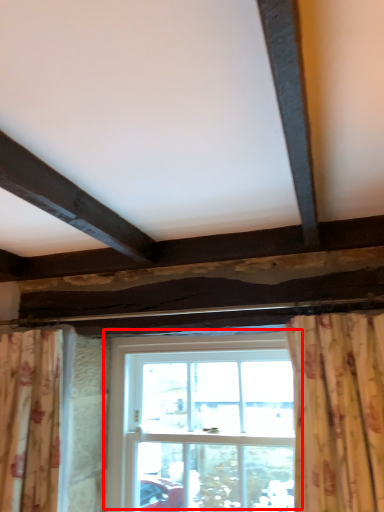
Question: From the image's perspective, where is window (annotated by the red box) located in relation to curtain in the image?

Choices:
 (A) above
 (B) below

Answer: (B)